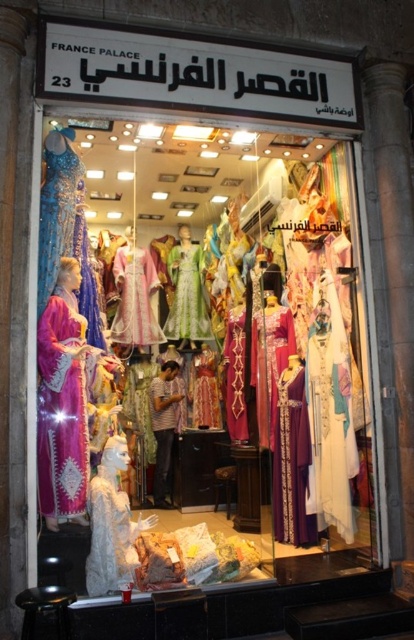
Question: Which point is farther from the camera taking this photo?

Choices:
 (A) (60, 592)
 (B) (190, 252)
 (C) (305, 492)
 (D) (72, 250)

Answer: (B)

Question: Which of these objects is positioned farthest from the green lace dress at center?

Choices:
 (A) black leather stool at lower left
 (B) matte purple dress at center

Answer: (A)

Question: Which point is farther to the camera?

Choices:
 (A) green lace dress at center
 (B) black leather stool at lower left
 (C) matte purple dress at center
 (D) shiny blue fabric dress at left

Answer: (A)

Question: Does shiny blue fabric dress at left appear on the right side of black leather stool at lower left?

Choices:
 (A) yes
 (B) no

Answer: (B)

Question: Can you confirm if matte purple dress at center is wider than shiny blue fabric dress at left?

Choices:
 (A) no
 (B) yes

Answer: (B)

Question: In this image, where is matte purple dress at center located relative to black leather stool at lower left?

Choices:
 (A) right
 (B) left

Answer: (A)